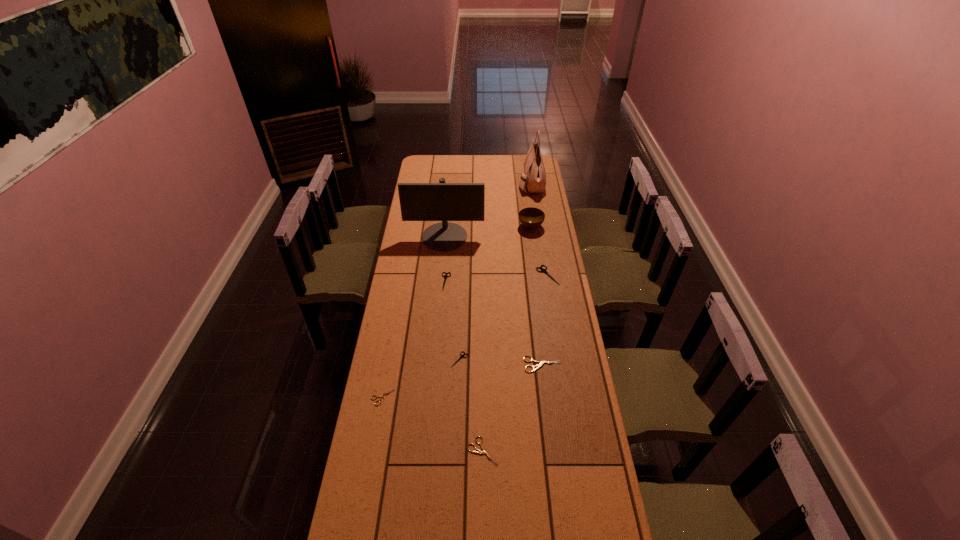
The height and width of the screenshot is (540, 960). Identify the location of free space between the sixth shortest object and the fifth shears from right to left. (496, 279).

Identify the location of free space between the biggest black shears and the leftmost black shears. (496, 279).

You are a GUI agent. You are given a task and a screenshot of the screen. Output one action in this format:
    pyautogui.click(x=<x>, y=<y>)
    Task: Click on the free point between the biggest beige shears and the tallest shears
    
    Given the screenshot: What is the action you would take?
    pyautogui.click(x=545, y=320)

I want to click on blank region between the fifth farthest shears and the gray computer monitor, so click(414, 317).

Locate an element on the screen. unoccupied position between the farthest beige shears and the second nearest shears is located at coordinates (463, 381).

I want to click on object that is the fifth nearest to the tallest shears, so click(461, 356).

I want to click on object that stands as the seventh closest to the biggest beige shears, so click(x=531, y=218).

Select which shears is the fourth closest to the handbag. Please provide its 2D coordinates. Your answer should be formatted as a tuple, i.e. [(x, y)], where the tuple contains the x and y coordinates of a point satisfying the conditions above.

[(461, 356)]

Identify the location of shears that stands as the fourth closest to the computer monitor. (541, 363).

Point out which black shears is positioned as the third nearest to the smallest beige shears. Please provide its 2D coordinates. Your answer should be formatted as a tuple, i.e. [(x, y)], where the tuple contains the x and y coordinates of a point satisfying the conditions above.

[(542, 270)]